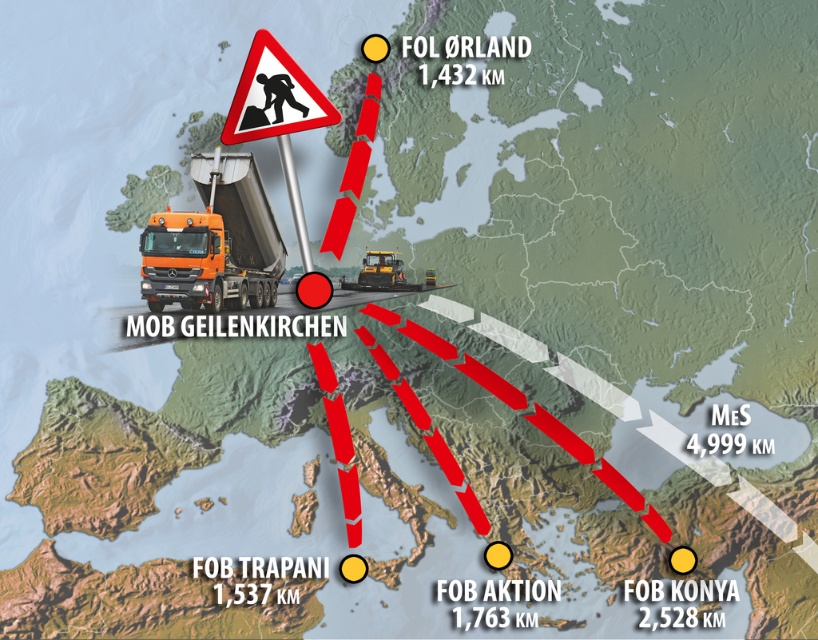
You are planning a delivery route using the map. The orange matte truck at center is located at coordinates 0.380, 0.263. If you need to place a new delivery point exactly 0.1 units north of the truck, what would be the new coordinates?

The new coordinates would be 0.380 in the x and 0.263 plus 0.1 in the y, so [295,243].

You are a delivery driver planning a route and see the orange matte truck at center and the red plastic triangle at upper center on the map. Which object takes up more space on the map?

The orange matte truck at center is bigger than the red plastic triangle at upper center, so it takes up more space on the map.